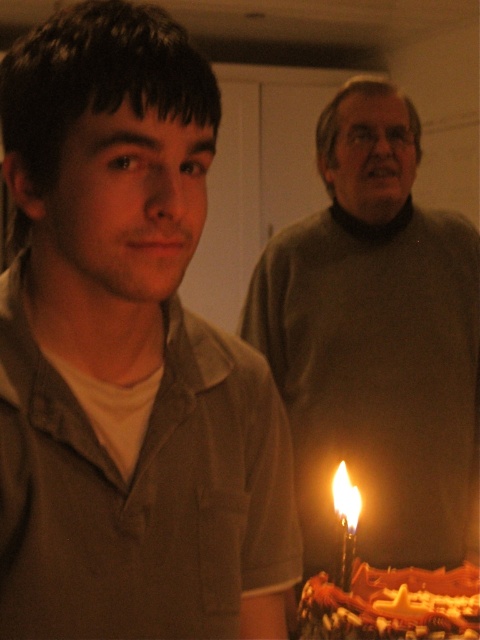
Question: Which of the following is the farthest from the observer?

Choices:
 (A) (52, 449)
 (B) (326, 225)

Answer: (B)

Question: Which point appears closest to the camera in this image?

Choices:
 (A) (348, 577)
 (B) (382, 442)
 (C) (364, 625)
 (D) (133, 204)

Answer: (D)

Question: Which object is the closest to the chocolate frosted cake at lower right?

Choices:
 (A) matte gray sweater at center
 (B) matte brown shirt at center

Answer: (A)

Question: Where is chocolate frosted cake at lower right located in relation to flametransparentbirthday candle at center in the image?

Choices:
 (A) left
 (B) right

Answer: (B)

Question: From the image, what is the correct spatial relationship of matte gray sweater at center in relation to chocolate frosted cake at lower right?

Choices:
 (A) above
 (B) below

Answer: (A)

Question: Can you confirm if matte gray sweater at center is thinner than flametransparentbirthday candle at center?

Choices:
 (A) yes
 (B) no

Answer: (B)